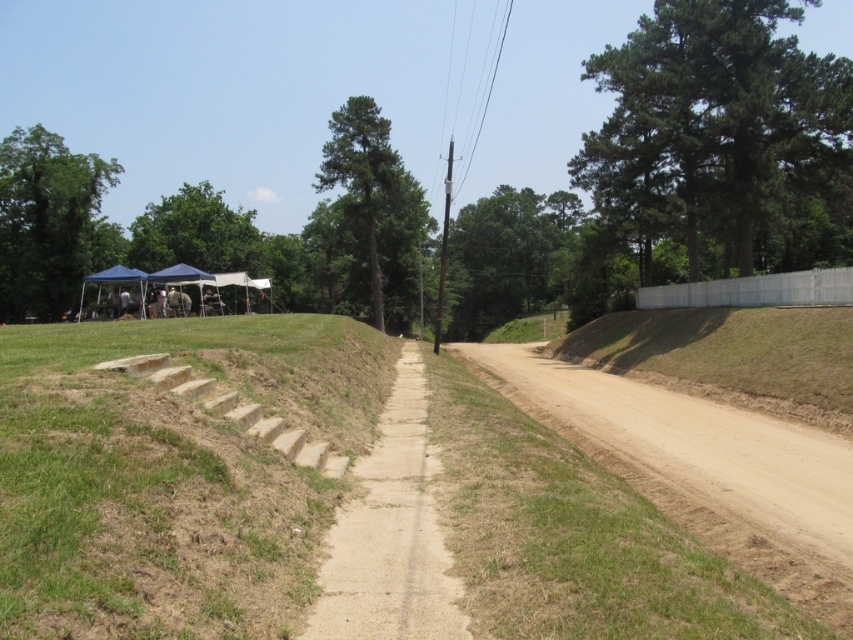
You are standing at the starting point of the dirt path in the rural scene. You want to walk towards the blue canopy tent where people are gathered. Which direction should you go relative to the green leafy tree at center?

You should walk to the left of the green leafy tree at center to reach the blue canopy tent where people are gathered.

You are standing at the point marked by the coordinates in the image. Looking around, you see the dirt path curving to your right and the grassy area with the blue canopy tent on the left. Which direction should you walk to reach the green grass at lower left located at point (172, 474)?

The green grass at lower left is located at point (172, 474), so you should walk towards the lower left direction to reach it.